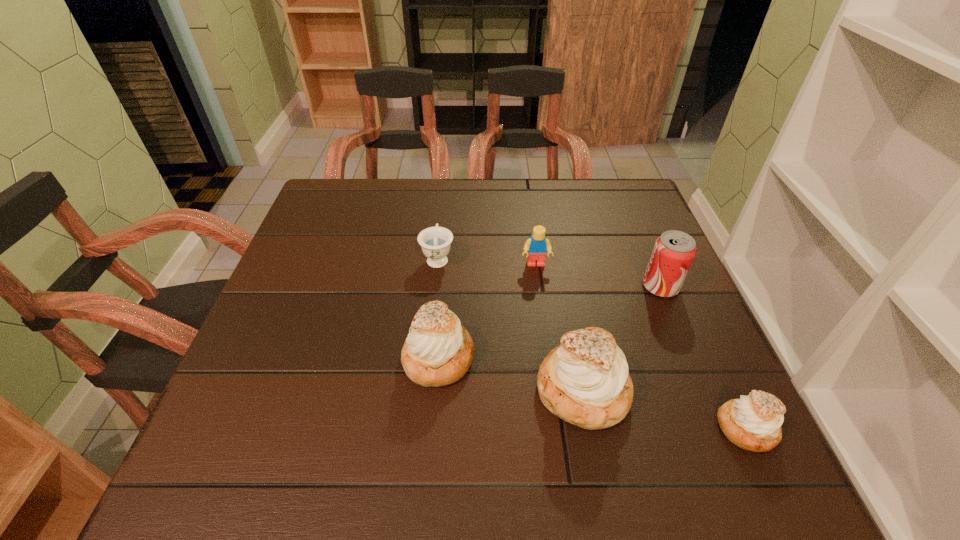
Find the location of `blank space at the right edge of the desktop`. blank space at the right edge of the desktop is located at coordinates (651, 323).

Locate an element on the screen. This screenshot has width=960, height=540. vacant space at the far left corner is located at coordinates (341, 187).

What are the coordinates of `blank area at the far right corner` in the screenshot? It's located at (606, 220).

The image size is (960, 540). I want to click on vacant area at the near right corner of the desktop, so click(x=676, y=401).

Find the location of a particular element. free space between the soda can and the Lego is located at coordinates (598, 275).

Identify the location of vacant space in between the third farthest object and the teacup. (549, 272).

The height and width of the screenshot is (540, 960). Find the location of `vacant space that is in between the leftmost pastry and the second pastry from left to right`. vacant space that is in between the leftmost pastry and the second pastry from left to right is located at coordinates (511, 374).

The image size is (960, 540). Identify the location of free point between the second tallest pastry and the Lego. (487, 311).

This screenshot has height=540, width=960. Identify the location of vacant point located between the teacup and the second pastry from right to left. (510, 324).

Find the location of a particular element. free space between the teacup and the second pastry from left to right is located at coordinates (510, 324).